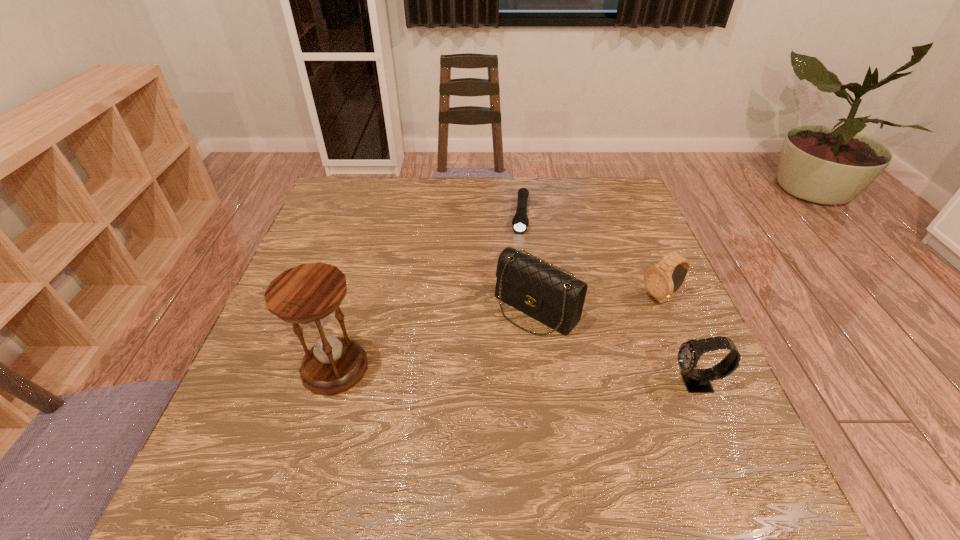
Identify the location of free space located 0.050m on the face of the nearer watch. (646, 383).

What are the coordinates of `vacant region located at the lens end of the shortest object` in the screenshot? It's located at (519, 258).

This screenshot has height=540, width=960. In order to click on blank space located at the lens end of the shortest object in this screenshot , I will do `click(518, 271)`.

Where is `free space located 0.120m at the lens end of the shortest object`? The image size is (960, 540). free space located 0.120m at the lens end of the shortest object is located at coordinates tap(519, 263).

Locate an element on the screen. This screenshot has width=960, height=540. free region located on the face of the farther watch is located at coordinates (541, 357).

Where is `free region located on the face of the farther watch`? The image size is (960, 540). free region located on the face of the farther watch is located at coordinates (610, 323).

Where is `blank space located on the face of the farther watch`? The width and height of the screenshot is (960, 540). blank space located on the face of the farther watch is located at coordinates (579, 339).

Locate an element on the screen. This screenshot has width=960, height=540. vacant space situated on the front flap of the clutch bag is located at coordinates (440, 407).

You are a GUI agent. You are given a task and a screenshot of the screen. Output one action in this format:
    pyautogui.click(x=<x>, y=<y>)
    Task: Click on the vacant region located 0.120m on the front flap of the clutch bag
    The image size is (960, 540).
    Given the screenshot: What is the action you would take?
    pyautogui.click(x=479, y=366)

Image resolution: width=960 pixels, height=540 pixels. What are the coordinates of `free space located on the front flap of the clutch bag` in the screenshot? It's located at tap(472, 372).